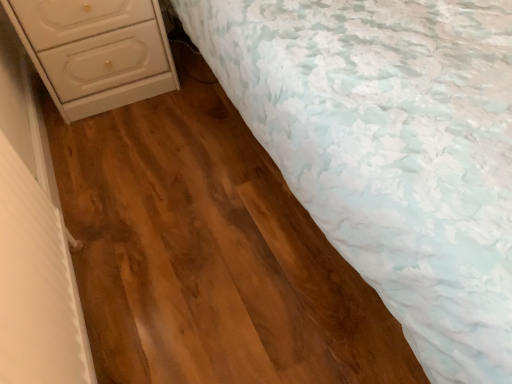
Question: Can you confirm if white floral fabric at upper right is wider than white glossy chest of drawers at left?

Choices:
 (A) yes
 (B) no

Answer: (A)

Question: Is white floral fabric at upper right not close to white glossy chest of drawers at left?

Choices:
 (A) yes
 (B) no

Answer: (B)

Question: Does white floral fabric at upper right contain white glossy chest of drawers at left?

Choices:
 (A) yes
 (B) no

Answer: (B)

Question: Is white floral fabric at upper right positioned before white glossy chest of drawers at left?

Choices:
 (A) no
 (B) yes

Answer: (B)

Question: Is white floral fabric at upper right turned away from white glossy chest of drawers at left?

Choices:
 (A) no
 (B) yes

Answer: (A)

Question: Can you confirm if white floral fabric at upper right is shorter than white glossy chest of drawers at left?

Choices:
 (A) yes
 (B) no

Answer: (B)

Question: From the image's perspective, is white glossy chest of drawers at left located beneath white floral fabric at upper right?

Choices:
 (A) yes
 (B) no

Answer: (A)

Question: Can you confirm if white glossy chest of drawers at left is bigger than white floral fabric at upper right?

Choices:
 (A) yes
 (B) no

Answer: (B)

Question: From a real-world perspective, is white glossy chest of drawers at left over white floral fabric at upper right?

Choices:
 (A) no
 (B) yes

Answer: (A)

Question: Considering the relative positions of white glossy chest of drawers at left and white floral fabric at upper right in the image provided, is white glossy chest of drawers at left to the right of white floral fabric at upper right from the viewer's perspective?

Choices:
 (A) yes
 (B) no

Answer: (B)

Question: Is white glossy chest of drawers at left wider than white floral fabric at upper right?

Choices:
 (A) yes
 (B) no

Answer: (B)

Question: Would you say white glossy chest of drawers at left is outside white floral fabric at upper right?

Choices:
 (A) no
 (B) yes

Answer: (B)

Question: Looking at the image, does white floral fabric at upper right seem bigger or smaller compared to white glossy chest of drawers at left?

Choices:
 (A) small
 (B) big

Answer: (B)